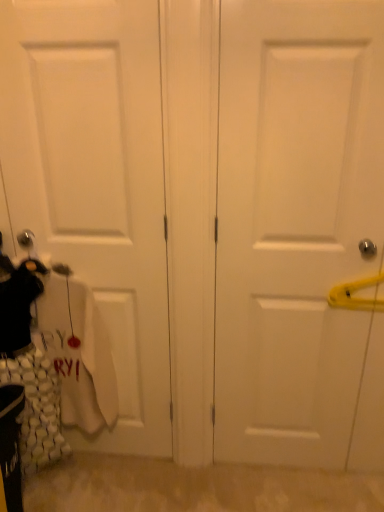
Question: From the image's perspective, is white matte door at left, placed as the 2th door when sorted from right to left, positioned above or below white matte door at right, marked as the second door in a left-to-right arrangement?

Choices:
 (A) below
 (B) above

Answer: (B)

Question: Considering the relative positions of white matte door at left, placed as the 2th door when sorted from right to left, and white matte door at right, which is the 1th door from right to left, in the image provided, is white matte door at left, placed as the 2th door when sorted from right to left, to the left or to the right of white matte door at right, which is the 1th door from right to left,?

Choices:
 (A) right
 (B) left

Answer: (B)

Question: Is white matte door at left, the first door in the left-to-right sequence, wider or thinner than white matte door at right, which is the 1th door from right to left?

Choices:
 (A) wide
 (B) thin

Answer: (B)

Question: Which is correct: white matte door at right, marked as the second door in a left-to-right arrangement, is inside white matte door at left, the first door in the left-to-right sequence, or outside of it?

Choices:
 (A) outside
 (B) inside

Answer: (A)

Question: Does point click(x=301, y=77) appear closer or farther from the camera than point click(x=61, y=199)?

Choices:
 (A) farther
 (B) closer

Answer: (B)

Question: From the image's perspective, is white matte door at right, which is the 1th door from right to left, located above or below white matte door at left, the first door in the left-to-right sequence?

Choices:
 (A) above
 (B) below

Answer: (B)

Question: From a real-world perspective, is white matte door at right, which is the 1th door from right to left, positioned above or below white matte door at left, placed as the 2th door when sorted from right to left?

Choices:
 (A) below
 (B) above

Answer: (A)